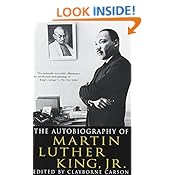
Identify the location of corded telephone. (42, 118).